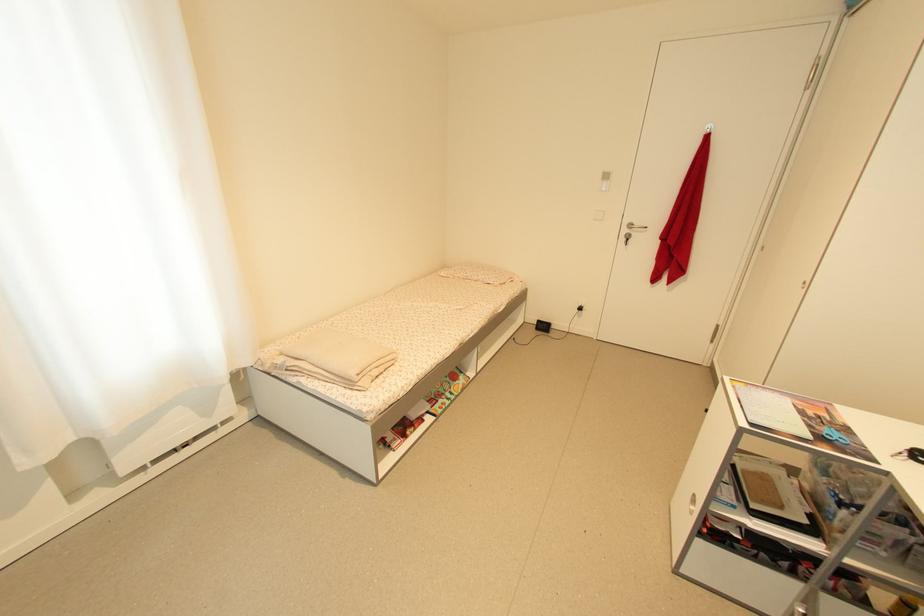
What are the coordinates of `patterned pillow` in the screenshot? It's located at (481, 273).